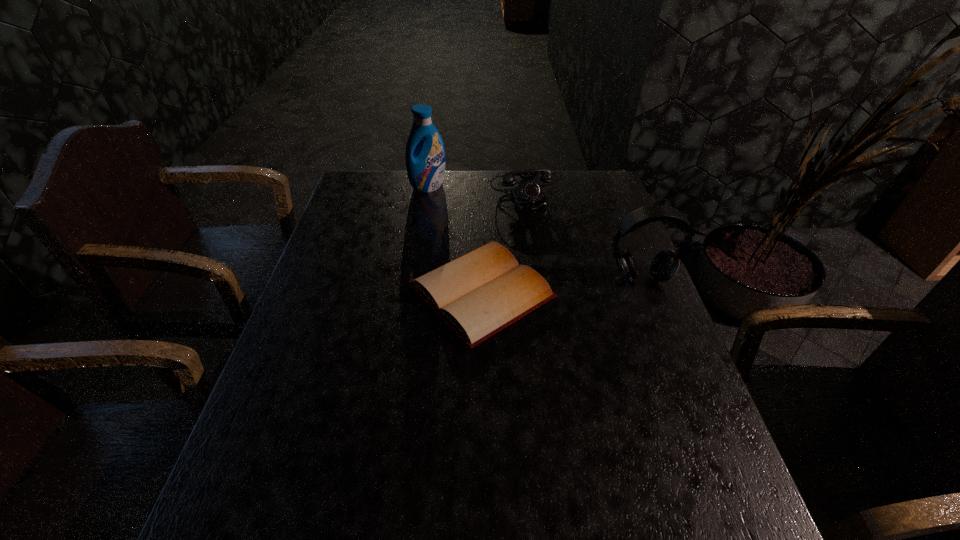
The height and width of the screenshot is (540, 960). Find the location of `free spot at the near left corner of the desktop`. free spot at the near left corner of the desktop is located at coordinates (310, 476).

In the image, there is a desktop. Where is `vacant space at the far right corner`? This screenshot has height=540, width=960. vacant space at the far right corner is located at coordinates (572, 203).

Find the location of `free space between the third shortest object and the tallest object`. free space between the third shortest object and the tallest object is located at coordinates (535, 232).

At what (x,y) coordinates should I click in order to perform the action: click on unoccupied area between the telephone and the tallest object. Please return your answer as a coordinate pair (x, y). Looking at the image, I should click on (477, 188).

The height and width of the screenshot is (540, 960). In order to click on vacant area that lies between the second shortest object and the second tallest object in this screenshot , I will do `click(583, 234)`.

Image resolution: width=960 pixels, height=540 pixels. In order to click on empty space between the Bible and the tallest object in this screenshot , I will do `click(455, 239)`.

I want to click on vacant area that lies between the detergent and the earphone, so click(x=535, y=232).

Where is `empty location between the shortest object and the tallest object`? Image resolution: width=960 pixels, height=540 pixels. empty location between the shortest object and the tallest object is located at coordinates (455, 239).

This screenshot has width=960, height=540. Identify the location of free space that is in between the shortest object and the earphone. (561, 285).

At what (x,y) coordinates should I click in order to perform the action: click on vacant area that lies between the telephone and the tallest object. Please return your answer as a coordinate pair (x, y). Image resolution: width=960 pixels, height=540 pixels. Looking at the image, I should click on (477, 188).